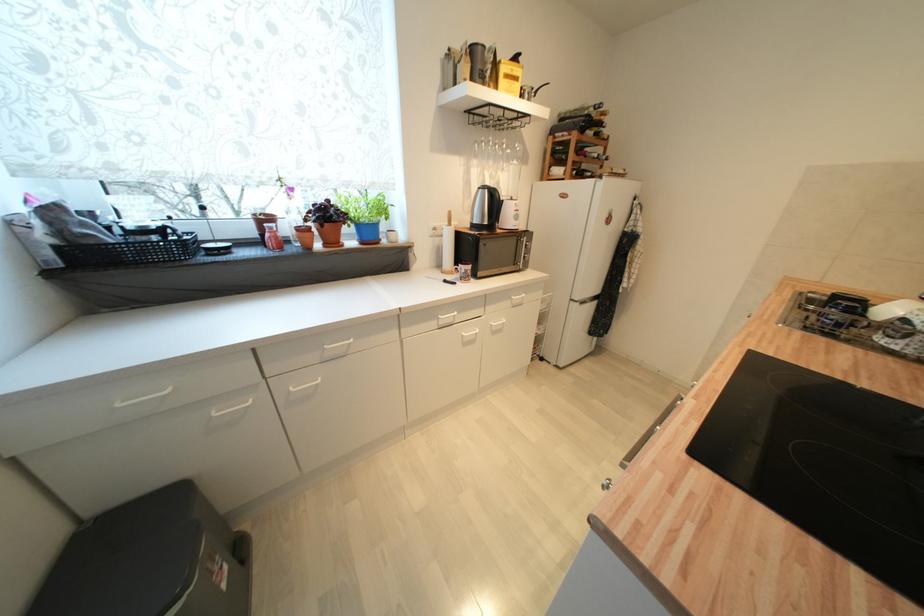
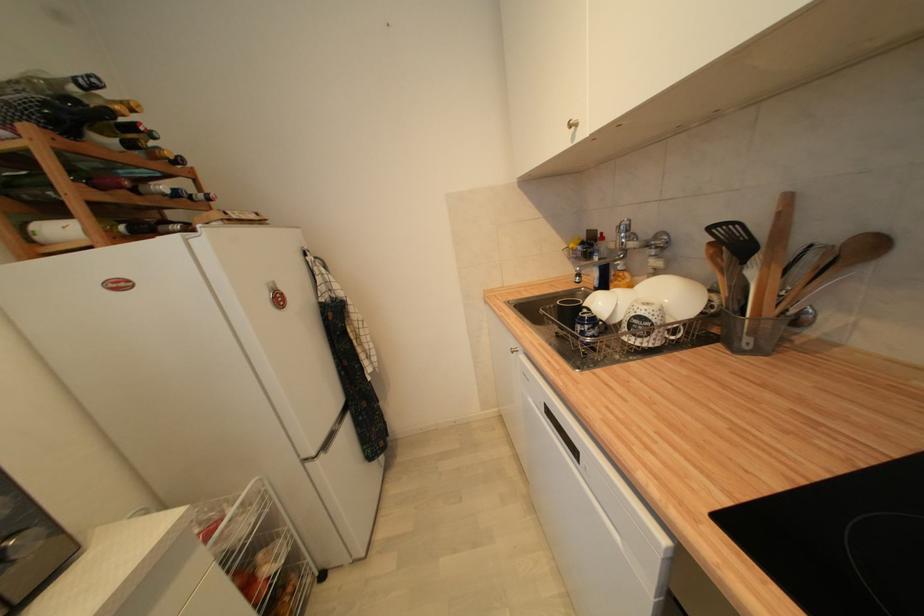
The point at (612,140) is marked in the first image. Where is the corresponding point in the second image?

(186, 164)